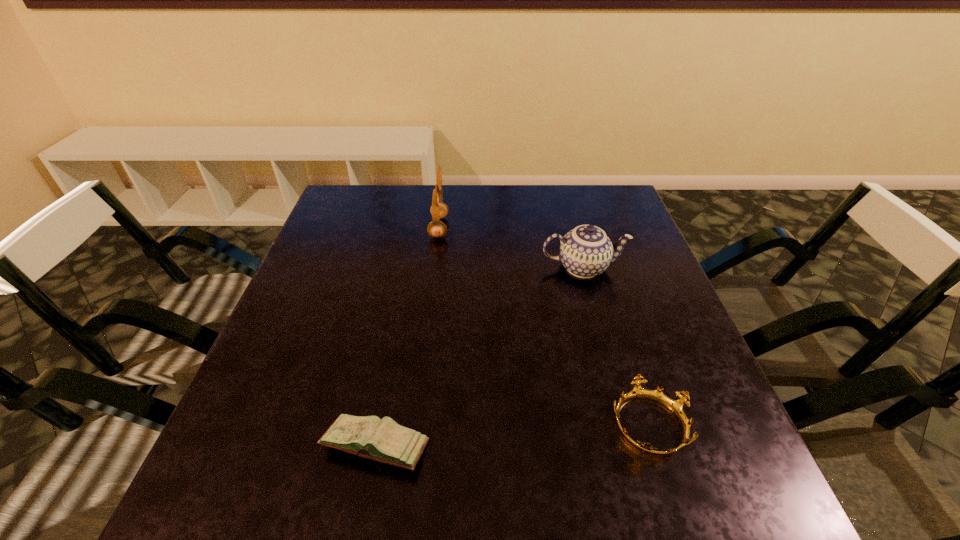
You are a GUI agent. You are given a task and a screenshot of the screen. Output one action in this format:
    pyautogui.click(x=<x>, y=<y>)
    Task: Click on the object that stands as the closest to the diary
    
    Given the screenshot: What is the action you would take?
    pyautogui.click(x=676, y=407)

Locate an element on the screen. free spot that satisfies the following two spatial constraints: 1. at the spout of the crown; 2. on the right side of the third shortest object is located at coordinates (626, 424).

Image resolution: width=960 pixels, height=540 pixels. Identify the location of free space in the image that satisfies the following two spatial constraints: 1. on the front-facing side of the farthest object; 2. on the front side of the diary. (412, 446).

This screenshot has width=960, height=540. I want to click on free region that satisfies the following two spatial constraints: 1. at the spout of the chinaware; 2. on the left side of the crown, so click(x=626, y=424).

Locate an element on the screen. free space that satisfies the following two spatial constraints: 1. on the back side of the crown; 2. on the front-facing side of the farthest object is located at coordinates (586, 227).

Locate an element on the screen. The height and width of the screenshot is (540, 960). blank space that satisfies the following two spatial constraints: 1. at the spout of the second farthest object; 2. on the right side of the crown is located at coordinates (626, 424).

Find the location of a particular element. The height and width of the screenshot is (540, 960). vacant space that satisfies the following two spatial constraints: 1. on the back side of the crown; 2. on the front-facing side of the earphone is located at coordinates (586, 227).